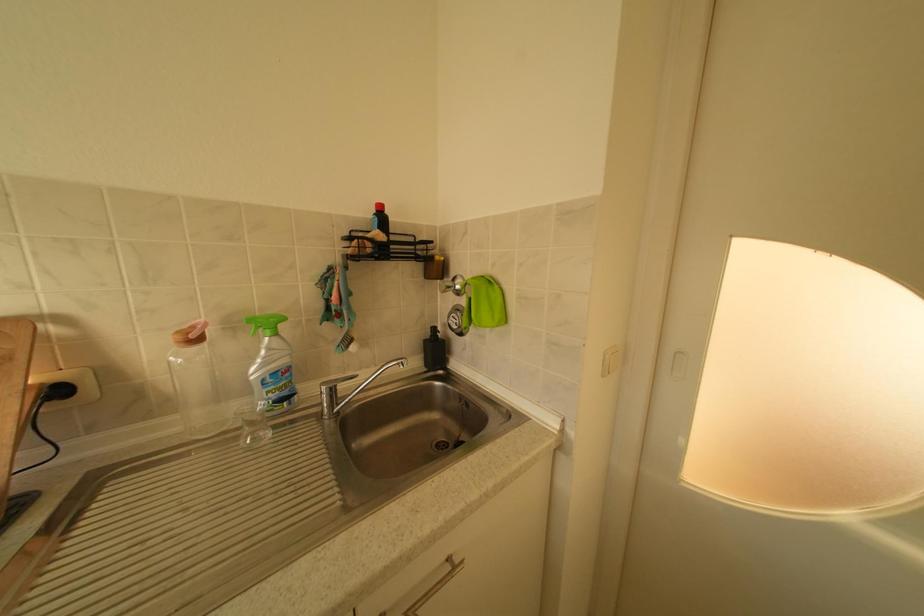
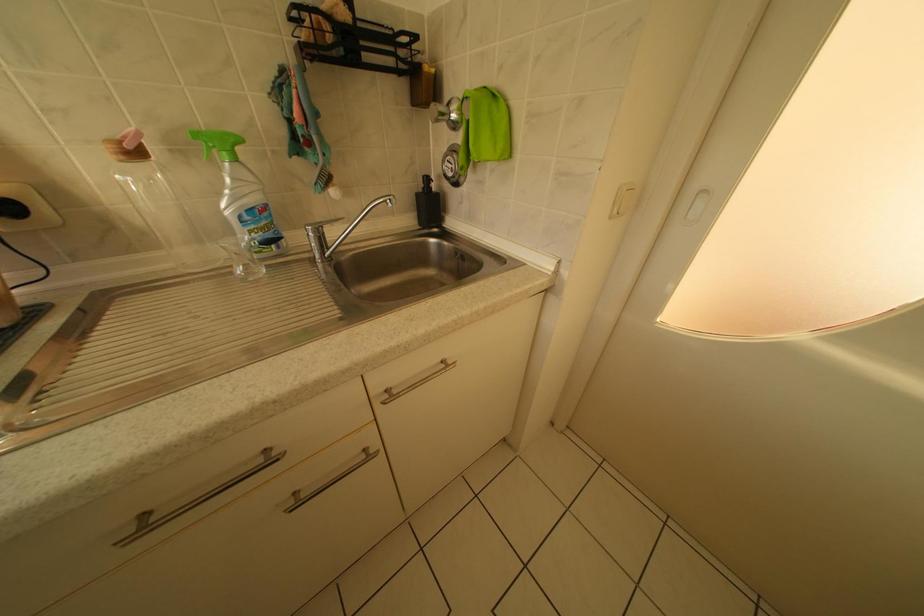
Question: How did the camera likely rotate?

Choices:
 (A) Left
 (B) Right
 (C) Up
 (D) Down

Answer: (D)